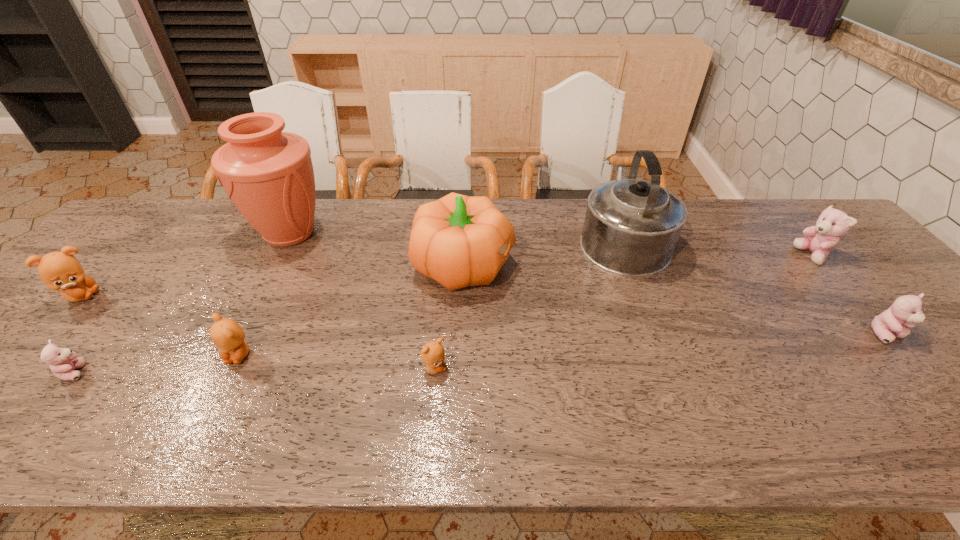
Identify the location of vacant area that lies between the rightmost brown teddy bear and the biggest pink teddy bear. Image resolution: width=960 pixels, height=540 pixels. (623, 312).

The width and height of the screenshot is (960, 540). Find the location of `empty location between the kettle and the biggest pink teddy bear`. empty location between the kettle and the biggest pink teddy bear is located at coordinates (717, 247).

Point out which object is positioned as the nearest to the pumpkin. Please provide its 2D coordinates. Your answer should be formatted as a tuple, i.e. [(x, y)], where the tuple contains the x and y coordinates of a point satisfying the conditions above.

[(432, 354)]

The width and height of the screenshot is (960, 540). I want to click on object that is the closest to the second biggest brown teddy bear, so click(64, 363).

Find the location of a particular element. This screenshot has width=960, height=540. the fifth closest teddy bear to the farthest pink teddy bear is located at coordinates (61, 271).

This screenshot has width=960, height=540. I want to click on teddy bear that stands as the second closest to the second brown teddy bear from left to right, so click(432, 354).

Image resolution: width=960 pixels, height=540 pixels. Identify the location of pink teddy bear object that ranks as the closest to the nearest pink teddy bear. (906, 310).

Identify which pink teddy bear is the closest to the rightmost brown teddy bear. Please provide its 2D coordinates. Your answer should be formatted as a tuple, i.e. [(x, y)], where the tuple contains the x and y coordinates of a point satisfying the conditions above.

[(64, 363)]

Point out which brown teddy bear is positioned as the nearest to the terracotta vase. Please provide its 2D coordinates. Your answer should be formatted as a tuple, i.e. [(x, y)], where the tuple contains the x and y coordinates of a point satisfying the conditions above.

[(227, 335)]

Locate which brown teddy bear ranks in proximity to the fourth teddy bear from left to right. Please provide its 2D coordinates. Your answer should be formatted as a tuple, i.e. [(x, y)], where the tuple contains the x and y coordinates of a point satisfying the conditions above.

[(227, 335)]